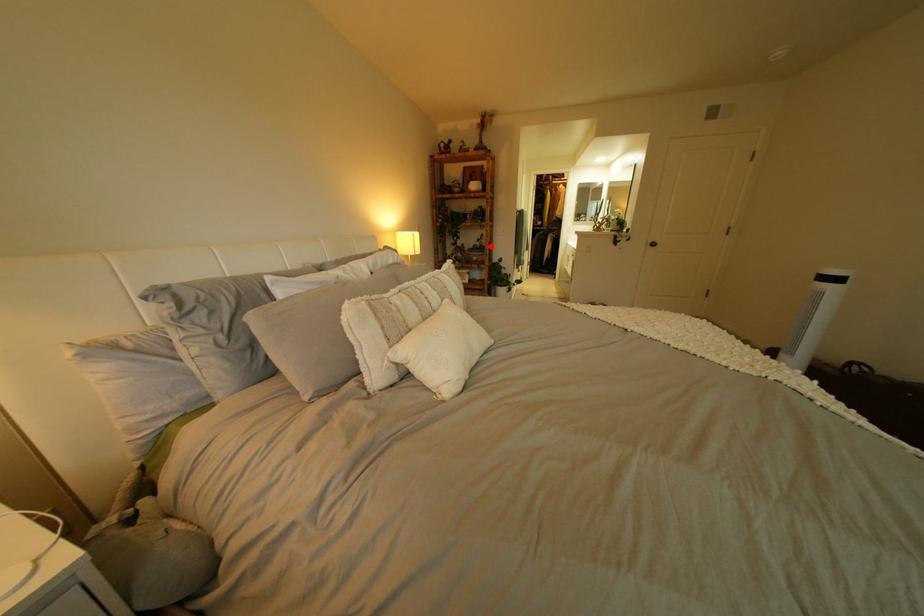
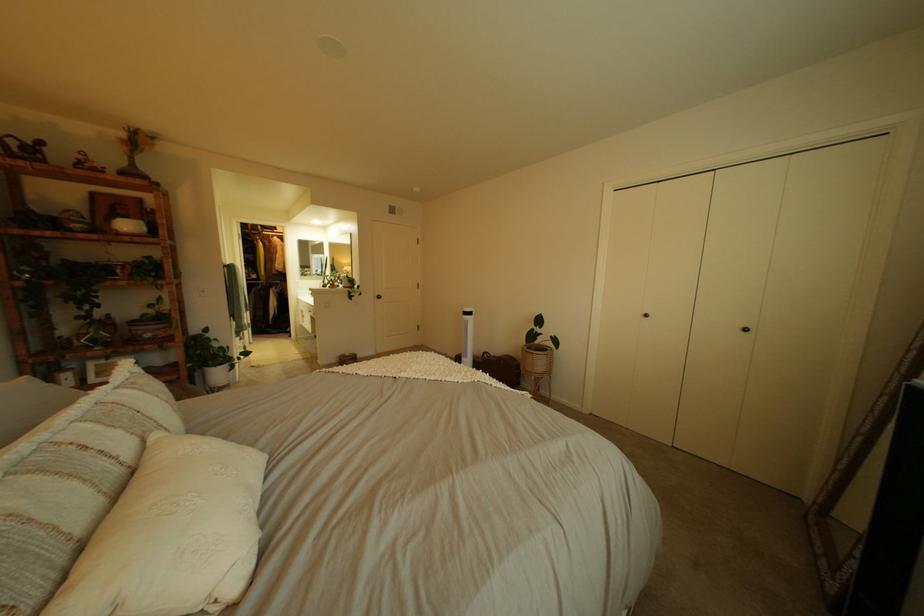
Question: I am providing you with two images of the same scene from different viewpoints. A red point is shown in image1. For the corresponding object point in image2, is it positioned nearer or farther from the camera?

Choices:
 (A) Nearer
 (B) Farther

Answer: (B)